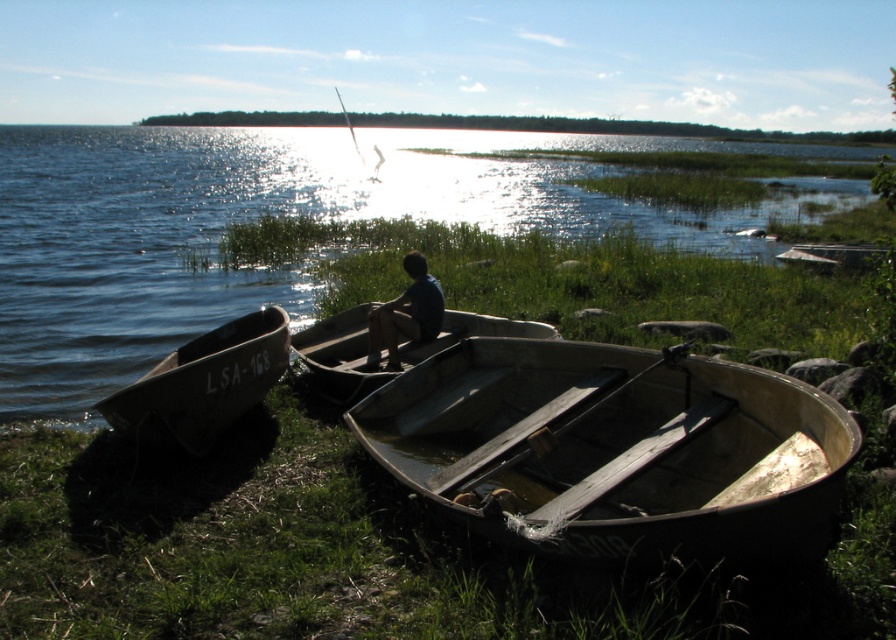
You are standing on the lakeside and see the rusty metal boat at lower right and the blue matte shirt at center. Which object is taller?

The blue matte shirt at center is taller than the rusty metal boat at lower right.

Looking at this image, you are standing on the lakeside and see the point at coordinates point (274,212). Is that point located on the glistening water at boat right?

Yes, the point (274,212) is on the glistening water at boat right.

You are standing at the lakeside and see the glistening water at boat right and the greenish metallic boat at lower left. Which object is closer to you?

The glistening water at boat right is closer to you because it is positioned over the greenish metallic boat at lower left, indicating it is in a higher plane and thus nearer in the visual perspective.